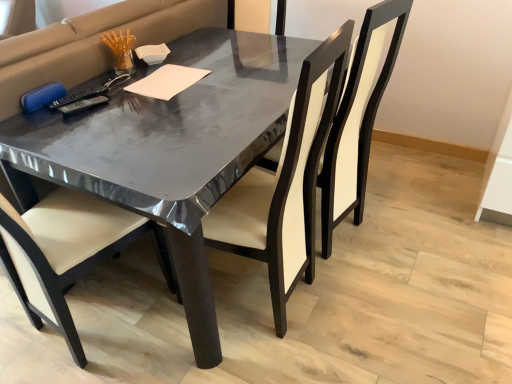
Locate an element on the screen. white paper at center is located at coordinates click(x=167, y=81).

Image resolution: width=512 pixels, height=384 pixels. What do you see at coordinates (358, 118) in the screenshot? I see `matte black chair at center, which ranks as the second chair in left-to-right order` at bounding box center [358, 118].

In order to face matte black chair at center, the second chair positioned from the right, should I rotate leftwards or rightwards?

Rotate left and turn 0.676 degrees.

Identify the location of white paper at center. The height and width of the screenshot is (384, 512). [x=167, y=81].

At what (x,y) coordinates should I click in order to perform the action: click on notepad behind the matte black chair at center, which ranks as the second chair in left-to-right order. Please return your answer as a coordinate pair (x, y). This screenshot has width=512, height=384. Looking at the image, I should click on (167, 81).

How much distance is there between matte black chair at center, the first chair positioned from the right, and white paper at center?

matte black chair at center, the first chair positioned from the right, is 27.89 inches from white paper at center.

Is the depth of matte black chair at center, which ranks as the second chair in left-to-right order, greater than that of white paper at center?

No.

Does white paper at center appear on the left side of matte black chair at center, the first chair positioned from the right?

Indeed, white paper at center is positioned on the left side of matte black chair at center, the first chair positioned from the right.

Which is in front, point (126, 90) or point (342, 133)?

Point (342, 133)

Is white paper at center looking in the opposite direction of matte black chair at center, which ranks as the second chair in left-to-right order?

No, matte black chair at center, which ranks as the second chair in left-to-right order, is not at the back of white paper at center.

From the image's perspective, which object appears higher, white paper at center or matte black chair at center, which ranks as the second chair in left-to-right order?

white paper at center, from the image's perspective.

Measure the distance between matte black chair at center, the first chair positioned from the right, and matte black chair at center, acting as the 1th chair starting from the left.

matte black chair at center, the first chair positioned from the right, is 10.17 inches away from matte black chair at center, acting as the 1th chair starting from the left.

Which of these two, matte black chair at center, the first chair positioned from the right, or matte black chair at center, acting as the 1th chair starting from the left, is wider?

Wider between the two is matte black chair at center, the first chair positioned from the right.

Based on the photo, which object is positioned more to the left, matte black chair at center, the first chair positioned from the right, or matte black chair at center, acting as the 1th chair starting from the left?

matte black chair at center, acting as the 1th chair starting from the left.

Considering the relative sizes of matte black chair at center, the first chair positioned from the right, and matte black chair at center, the second chair positioned from the right, in the image provided, is matte black chair at center, the first chair positioned from the right, smaller than matte black chair at center, the second chair positioned from the right,?

Incorrect, matte black chair at center, the first chair positioned from the right, is not smaller in size than matte black chair at center, the second chair positioned from the right.

From a real-world perspective, is white paper at center on matte black chair at center, acting as the 1th chair starting from the left?

Indeed, from a real-world perspective, white paper at center stands above matte black chair at center, acting as the 1th chair starting from the left.

From the image's perspective, is white paper at center over matte black chair at center, the second chair positioned from the right?

Yes.

In the scene shown: Relative to matte black chair at center, acting as the 1th chair starting from the left, is white paper at center in front or behind?

In the image, white paper at center appears behind matte black chair at center, acting as the 1th chair starting from the left.

Considering the relative sizes of white paper at center and matte black chair at center, the second chair positioned from the right, in the image provided, is white paper at center wider than matte black chair at center, the second chair positioned from the right,?

No.

From the image's perspective, between matte black chair at center, acting as the 1th chair starting from the left, and white paper at center, who is located below?

From the image's view, matte black chair at center, acting as the 1th chair starting from the left, is below.

From a real-world perspective, is matte black chair at center, acting as the 1th chair starting from the left, positioned above or below white paper at center?

From a real-world perspective, matte black chair at center, acting as the 1th chair starting from the left, is physically below white paper at center.

Considering the positions of point (322, 79) and point (189, 82), is point (322, 79) closer or farther from the camera than point (189, 82)?

Point (322, 79) appears to be closer to the viewer than point (189, 82).

Is matte black chair at center, the second chair positioned from the right, taller than white paper at center?

Correct, matte black chair at center, the second chair positioned from the right, is much taller as white paper at center.

Between matte black chair at center, the second chair positioned from the right, and matte black chair at center, which ranks as the second chair in left-to-right order, which one is positioned behind?

matte black chair at center, which ranks as the second chair in left-to-right order.

Is matte black chair at center, the second chair positioned from the right, far from matte black chair at center, which ranks as the second chair in left-to-right order?

No.

From the picture: Could you measure the distance between matte black chair at center, the second chair positioned from the right, and matte black chair at center, the first chair positioned from the right?

A distance of 10.17 inches exists between matte black chair at center, the second chair positioned from the right, and matte black chair at center, the first chair positioned from the right.

Is matte black chair at center, acting as the 1th chair starting from the left, taller than matte black chair at center, which ranks as the second chair in left-to-right order?

Yes, matte black chair at center, acting as the 1th chair starting from the left, is taller than matte black chair at center, which ranks as the second chair in left-to-right order.

At what (x,y) coordinates should I click in order to perform the action: click on chair that is the 2nd object to the right of the white paper at center, starting at the anchor. Please return your answer as a coordinate pair (x, y). Looking at the image, I should click on (358, 118).

Find the location of a particular element. Image resolution: width=512 pixels, height=384 pixels. chair that is the 1st one when counting forward from the white paper at center is located at coordinates (358, 118).

From the image, which object appears to be farther from white paper at center, matte black chair at center, the first chair positioned from the right, or matte black chair at center, the second chair positioned from the right?

matte black chair at center, the first chair positioned from the right, is positioned further to the anchor white paper at center.

From the image, which object appears to be farther from matte black chair at center, the second chair positioned from the right, matte black chair at center, the first chair positioned from the right, or white paper at center?

Based on the image, white paper at center appears to be further to matte black chair at center, the second chair positioned from the right.

Based on the photo, based on their spatial positions, is white paper at center or matte black chair at center, acting as the 1th chair starting from the left, further from matte black chair at center, the first chair positioned from the right?

Among the two, white paper at center is located further to matte black chair at center, the first chair positioned from the right.

Considering their positions, is matte black chair at center, acting as the 1th chair starting from the left, positioned closer to matte black chair at center, which ranks as the second chair in left-to-right order, than white paper at center?

Based on the image, matte black chair at center, acting as the 1th chair starting from the left, appears to be nearer to matte black chair at center, which ranks as the second chair in left-to-right order.

Which object lies further to the anchor point matte black chair at center, the second chair positioned from the right, white paper at center or matte black chair at center, which ranks as the second chair in left-to-right order?

Among the two, white paper at center is located further to matte black chair at center, the second chair positioned from the right.

When comparing their distances from white paper at center, does matte black chair at center, the second chair positioned from the right, or matte black chair at center, which ranks as the second chair in left-to-right order, seem further?

Based on the image, matte black chair at center, which ranks as the second chair in left-to-right order, appears to be further to white paper at center.

You are a GUI agent. You are given a task and a screenshot of the screen. Output one action in this format:
    pyautogui.click(x=<x>, y=<y>)
    Task: Click on the chair between matte black chair at center, the second chair positioned from the right, and white paper at center in the front-back direction
    This screenshot has height=384, width=512.
    Given the screenshot: What is the action you would take?
    pyautogui.click(x=358, y=118)